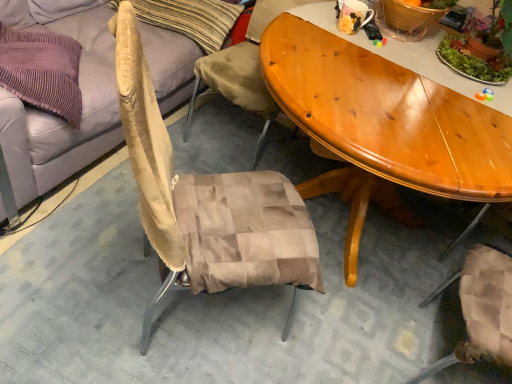
Question: Is matte ceramic mug at upper center not close to green leafy plant at upper right?

Choices:
 (A) no
 (B) yes

Answer: (A)

Question: Can you confirm if matte ceramic mug at upper center is smaller than green leafy plant at upper right?

Choices:
 (A) yes
 (B) no

Answer: (A)

Question: Is matte ceramic mug at upper center facing towards green leafy plant at upper right?

Choices:
 (A) yes
 (B) no

Answer: (B)

Question: Can you see matte ceramic mug at upper center touching green leafy plant at upper right?

Choices:
 (A) no
 (B) yes

Answer: (A)

Question: Is matte ceramic mug at upper center not within green leafy plant at upper right?

Choices:
 (A) no
 (B) yes

Answer: (B)

Question: Is the position of matte ceramic mug at upper center less distant than that of green leafy plant at upper right?

Choices:
 (A) yes
 (B) no

Answer: (B)

Question: From a real-world perspective, is beige fabric couch at upper left over beige fabric pillow at upper left?

Choices:
 (A) no
 (B) yes

Answer: (A)

Question: Is the depth of beige fabric couch at upper left greater than that of beige fabric pillow at upper left?

Choices:
 (A) no
 (B) yes

Answer: (A)

Question: From a real-world perspective, is beige fabric couch at upper left located beneath beige fabric pillow at upper left?

Choices:
 (A) yes
 (B) no

Answer: (A)

Question: Is beige fabric couch at upper left far away from beige fabric pillow at upper left?

Choices:
 (A) no
 (B) yes

Answer: (A)

Question: Can you confirm if beige fabric couch at upper left is smaller than beige fabric pillow at upper left?

Choices:
 (A) no
 (B) yes

Answer: (A)

Question: From the image's perspective, does beige fabric couch at upper left appear higher than beige fabric pillow at upper left?

Choices:
 (A) no
 (B) yes

Answer: (A)

Question: From the image's perspective, is beige fabric pillow at upper left above beige fabric couch at upper left?

Choices:
 (A) no
 (B) yes

Answer: (B)